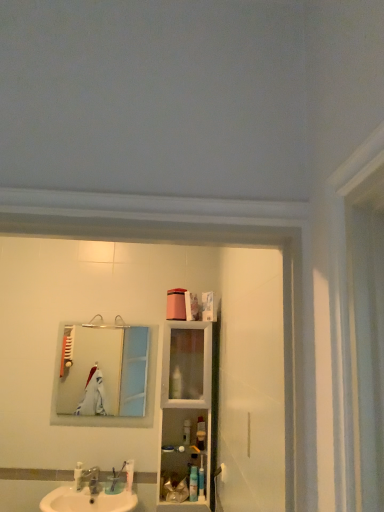
Where is `spots to the right of brushed metal faucet at sink front`? The width and height of the screenshot is (384, 512). spots to the right of brushed metal faucet at sink front is located at coordinates (116, 499).